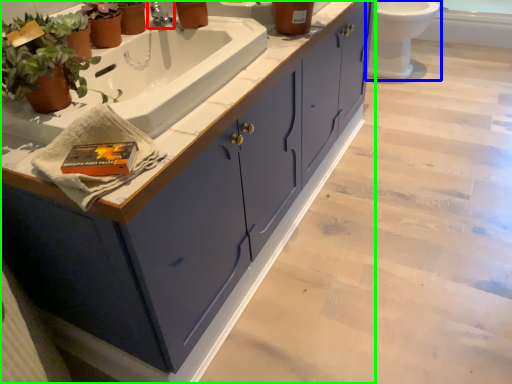
Question: Based on their relative distances, which object is farther from tap (highlighted by a red box)? Choose from toilet (highlighted by a blue box) and bathroom cabinet (highlighted by a green box).

Choices:
 (A) toilet
 (B) bathroom cabinet

Answer: (A)